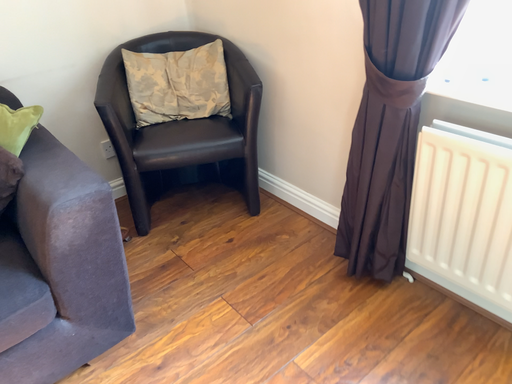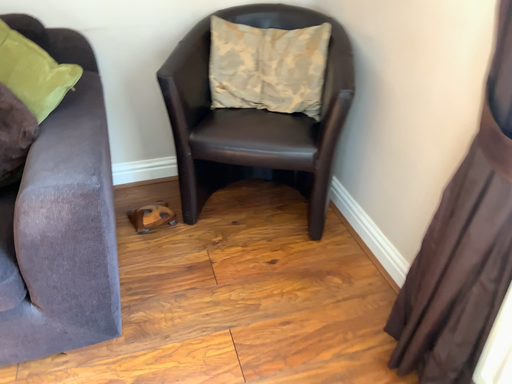
Question: Which way did the camera rotate in the video?

Choices:
 (A) rotated left
 (B) rotated right

Answer: (A)